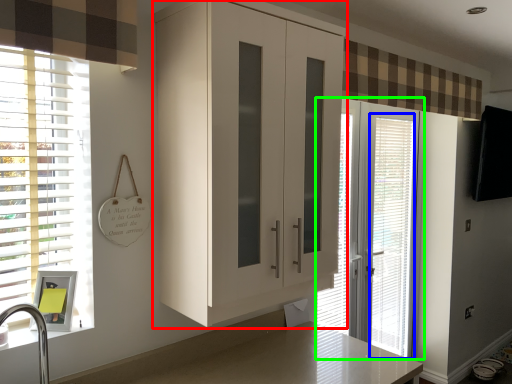
Question: Which object is positioned closest to cabinetry (highlighted by a red box)? Select from blind (highlighted by a blue box) and door (highlighted by a green box).

Choices:
 (A) blind
 (B) door

Answer: (B)